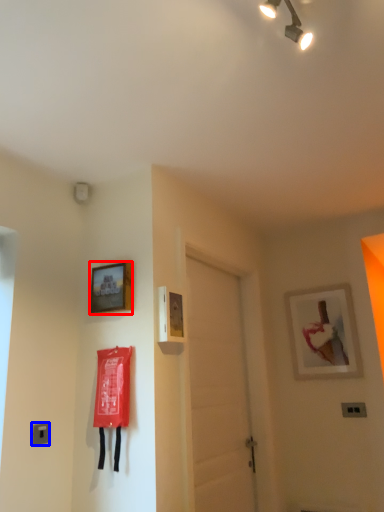
Question: Among these objects, which one is nearest to the camera, picture frame (highlighted by a red box) or light switch (highlighted by a blue box)?

Choices:
 (A) picture frame
 (B) light switch

Answer: (B)